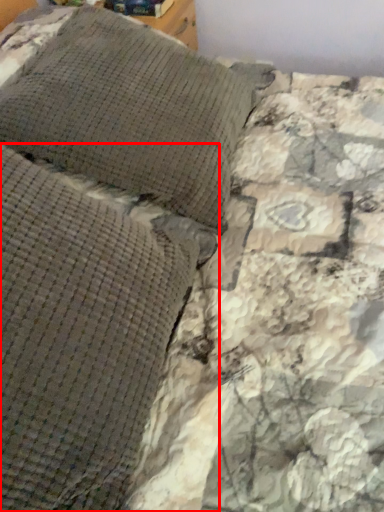
Question: In this image, where is pillow (annotated by the red box) located relative to pillow?

Choices:
 (A) left
 (B) right

Answer: (A)